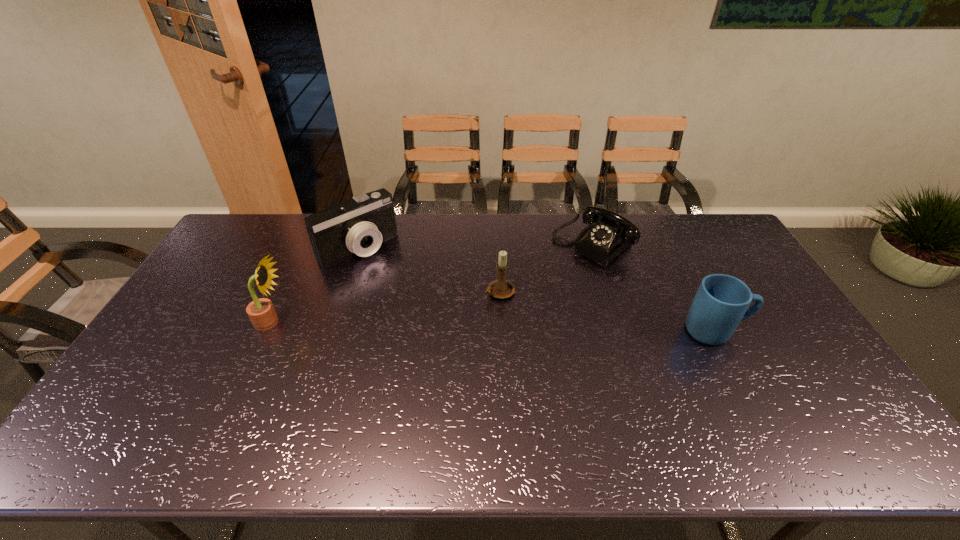
What are the coordinates of `empty space that is in between the leftmost object and the candle holder` in the screenshot? It's located at (386, 307).

Find the location of a particular element. This screenshot has width=960, height=540. free point between the mug and the camcorder is located at coordinates 537,289.

Find the location of a particular element. free point between the camcorder and the sunflower is located at coordinates (315, 285).

Where is `empty location between the rightmost object and the leftmost object`? This screenshot has width=960, height=540. empty location between the rightmost object and the leftmost object is located at coordinates (x=493, y=327).

You are a GUI agent. You are given a task and a screenshot of the screen. Output one action in this format:
    pyautogui.click(x=<x>, y=<y>)
    Task: Click on the free spot between the third farthest object and the tallest object
    The width and height of the screenshot is (960, 540).
    Given the screenshot: What is the action you would take?
    pyautogui.click(x=386, y=307)

Where is `unoccupied area between the rightmost object and the tallest object`? unoccupied area between the rightmost object and the tallest object is located at coordinates (493, 327).

Find the location of a particular element. The height and width of the screenshot is (540, 960). free space between the fourth object from left to right and the camcorder is located at coordinates (476, 246).

At what (x,y) coordinates should I click in order to perform the action: click on empty location between the telephone and the mug. Please return your answer as a coordinate pair (x, y). Looking at the image, I should click on (654, 288).

Choose which object is the third nearest neighbor to the third object from left to right. Please provide its 2D coordinates. Your answer should be formatted as a tuple, i.e. [(x, y)], where the tuple contains the x and y coordinates of a point satisfying the conditions above.

[(721, 302)]

At what (x,y) coordinates should I click in order to perform the action: click on the third closest object relative to the third nearest object. Please return your answer as a coordinate pair (x, y). The height and width of the screenshot is (540, 960). Looking at the image, I should click on (721, 302).